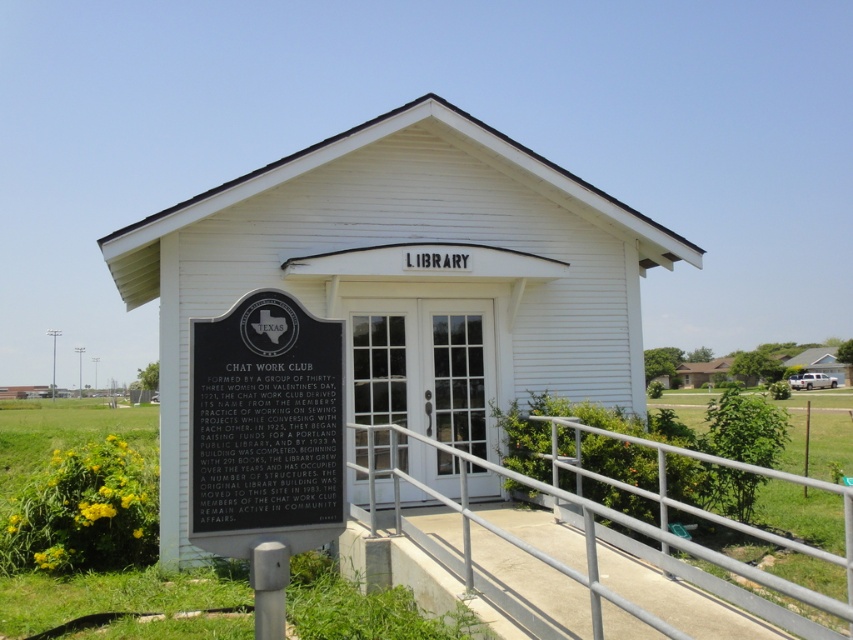
You are a GUI agent. You are given a task and a screenshot of the screen. Output one action in this format:
    pyautogui.click(x=<x>, y=<y>)
    Task: Click on the black metal plaque at lower left
    The height and width of the screenshot is (640, 853).
    Given the screenshot: What is the action you would take?
    pyautogui.click(x=265, y=426)

Who is shorter, black metal plaque at lower left or silver metallic handrail at lower center?

Standing shorter between the two is silver metallic handrail at lower center.

Is point (337, 390) positioned behind point (407, 481)?

No, (337, 390) is closer to viewer.

Identify the location of black metal plaque at lower left. (265, 426).

Does white wooden church at center lie behind silver metallic handrail at lower center?

Yes, it is.

Does point (373, 339) come closer to viewer compared to point (587, 509)?

No.

Who is more distant from viewer, (x=357, y=156) or (x=370, y=499)?

The point (x=357, y=156) is behind.

This screenshot has width=853, height=640. I want to click on white wooden church at center, so click(x=407, y=278).

At what (x,y) coordinates should I click in order to perform the action: click on white wooden church at center. Please return your answer as a coordinate pair (x, y). Looking at the image, I should click on (407, 278).

Can you confirm if white wooden church at center is positioned to the right of black metal plaque at lower left?

Yes, white wooden church at center is to the right of black metal plaque at lower left.

Measure the distance between white wooden church at center and camera.

8.53 meters

This screenshot has height=640, width=853. Find the location of `white wooden church at center`. white wooden church at center is located at coordinates (407, 278).